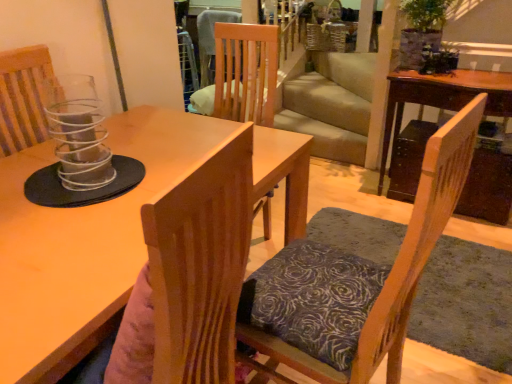
Identify the location of wooden table at right, which is the 2th table in front-to-back order. (442, 98).

The image size is (512, 384). I want to click on matte wooden table at center, the 2th table from the right, so click(x=83, y=244).

This screenshot has width=512, height=384. What do you see at coordinates (80, 144) in the screenshot?
I see `clear glass candle holder at left` at bounding box center [80, 144].

In order to click on clear glass candle holder at left in this screenshot , I will do `click(80, 144)`.

Where is `wooden chair with patterned cushion at center, the 2th chair from the left`? This screenshot has width=512, height=384. wooden chair with patterned cushion at center, the 2th chair from the left is located at coordinates [x=360, y=278].

Does matte wooden table at center, which is the second table from back to front, have a lesser height compared to wooden table at right, which is the first table from right to left?

Indeed, matte wooden table at center, which is the second table from back to front, has a lesser height compared to wooden table at right, which is the first table from right to left.

Between matte wooden table at center, the 2th table from the right, and wooden table at right, arranged as the second table when viewed from the left, which one has smaller size?

With smaller size is matte wooden table at center, the 2th table from the right.

Which point is more forward, (x=118, y=258) or (x=404, y=88)?

The point (x=118, y=258) is in front.

Between wooden chair with patterned cushion at center, the 1th chair when ordered from right to left, and wooden table at right, which is the first table from right to left, which one has smaller size?

With smaller size is wooden chair with patterned cushion at center, the 1th chair when ordered from right to left.

From a real-world perspective, is wooden chair with patterned cushion at center, the 1th chair when ordered from right to left, above or below wooden table at right, which appears as the first table when viewed from the back?

wooden chair with patterned cushion at center, the 1th chair when ordered from right to left, is situated higher than wooden table at right, which appears as the first table when viewed from the back, in the real world.

What's the angular difference between wooden chair with patterned cushion at center, the 1th chair when ordered from right to left, and wooden table at right, which is the first table from right to left,'s facing directions?

Result: 99.5 degrees separate the facing orientations of wooden chair with patterned cushion at center, the 1th chair when ordered from right to left, and wooden table at right, which is the first table from right to left.

Considering the sizes of objects wooden chair with patterned cushion at center, the 2th chair from the left, and wooden table at right, arranged as the second table when viewed from the left, in the image provided, who is taller, wooden chair with patterned cushion at center, the 2th chair from the left, or wooden table at right, arranged as the second table when viewed from the left,?

wooden chair with patterned cushion at center, the 2th chair from the left, is taller.

Who is bigger, clear glass candle holder at left or matte wooden table at center, which is the second table from back to front?

matte wooden table at center, which is the second table from back to front.

Does clear glass candle holder at left have a lesser width compared to matte wooden table at center, the 2th table from the right?

Yes, clear glass candle holder at left is thinner than matte wooden table at center, the 2th table from the right.

Between clear glass candle holder at left and matte wooden table at center, which ranks as the first table in front-to-back order, which one appears on the left side from the viewer's perspective?

clear glass candle holder at left is more to the left.

Who is shorter, clear glass candle holder at left or matte wooden table at center, which ranks as the first table in front-to-back order?

clear glass candle holder at left is shorter.

You are a GUI agent. You are given a task and a screenshot of the screen. Output one action in this format:
    pyautogui.click(x=<x>, y=<y>)
    Task: Click on the chair below the matte wooden table at center, the 1th table in the left-to-right sequence (from a real-world perspective)
    This screenshot has width=512, height=384.
    Given the screenshot: What is the action you would take?
    pyautogui.click(x=360, y=278)

Does wooden chair with patterned cushion at center, the 2th chair from the left, have a smaller size compared to matte wooden table at center, the 1th table in the left-to-right sequence?

No, wooden chair with patterned cushion at center, the 2th chair from the left, is not smaller than matte wooden table at center, the 1th table in the left-to-right sequence.

From the picture: From a real-world perspective, which object stands above the other?

matte wooden table at center, which ranks as the first table in front-to-back order, from a real-world perspective.

How different are the orientations of wooden chair with patterned cushion at center, the 2th chair from the left, and matte wooden table at center, which ranks as the first table in front-to-back order, in degrees?

7.91 degrees.

From a real-world perspective, which is physically below, transparent plastic chair at upper left, placed as the 2th chair when sorted from right to left, or matte wooden table at center, which ranks as the first table in front-to-back order?

matte wooden table at center, which ranks as the first table in front-to-back order.

Is transparent plastic chair at upper left, placed as the 2th chair when sorted from right to left, looking in the opposite direction of matte wooden table at center, which ranks as the first table in front-to-back order?

That's not correct — transparent plastic chair at upper left, placed as the 2th chair when sorted from right to left, is not looking away from matte wooden table at center, which ranks as the first table in front-to-back order.

Can you tell me how much transparent plastic chair at upper left, placed as the 2th chair when sorted from right to left, and matte wooden table at center, the 1th table in the left-to-right sequence, differ in facing direction?

There is a 178-degree angle between the facing directions of transparent plastic chair at upper left, placed as the 2th chair when sorted from right to left, and matte wooden table at center, the 1th table in the left-to-right sequence.

Does transparent plastic chair at upper left, placed as the 2th chair when sorted from right to left, come in front of matte wooden table at center, which is the second table from back to front?

No, it is behind matte wooden table at center, which is the second table from back to front.

Is transparent plastic chair at upper left, placed as the 2th chair when sorted from right to left, with clear glass candle holder at left?

No, transparent plastic chair at upper left, placed as the 2th chair when sorted from right to left, is not in contact with clear glass candle holder at left.

Which object is further away from the camera, transparent plastic chair at upper left, placed as the 2th chair when sorted from right to left, or clear glass candle holder at left?

transparent plastic chair at upper left, placed as the 2th chair when sorted from right to left, is more distant.

Based on the photo, is transparent plastic chair at upper left, the 1th chair viewed from the left, positioned with its back to clear glass candle holder at left?

No, transparent plastic chair at upper left, the 1th chair viewed from the left, is not facing away from clear glass candle holder at left.

Which object is thinner, matte wooden table at center, the 2th table from the right, or transparent plastic chair at upper left, placed as the 2th chair when sorted from right to left?

matte wooden table at center, the 2th table from the right.

From a real-world perspective, which is physically below, matte wooden table at center, which ranks as the first table in front-to-back order, or transparent plastic chair at upper left, the 1th chair viewed from the left?

matte wooden table at center, which ranks as the first table in front-to-back order, is physically lower.

Who is more distant, matte wooden table at center, the 2th table from the right, or transparent plastic chair at upper left, the 1th chair viewed from the left?

transparent plastic chair at upper left, the 1th chair viewed from the left, is further away from the camera.

Image resolution: width=512 pixels, height=384 pixels. I want to click on table above the wooden table at right, which is the 2th table in front-to-back order (from a real-world perspective), so coord(83,244).

This screenshot has width=512, height=384. Find the location of `table on the right of wooden chair with patterned cushion at center, the 1th chair when ordered from right to left`. table on the right of wooden chair with patterned cushion at center, the 1th chair when ordered from right to left is located at coordinates (442, 98).

Based on their spatial positions, is wooden table at right, which is the first table from right to left, or matte wooden table at center, which is the second table from back to front, further from transparent plastic chair at upper left, placed as the 2th chair when sorted from right to left?

wooden table at right, which is the first table from right to left, lies further to transparent plastic chair at upper left, placed as the 2th chair when sorted from right to left, than the other object.

Based on their spatial positions, is clear glass candle holder at left or transparent plastic chair at upper left, the 1th chair viewed from the left, closer to matte wooden table at center, which is the second table from back to front?

clear glass candle holder at left is positioned closer to the anchor matte wooden table at center, which is the second table from back to front.

Estimate the real-world distances between objects in this image. Which object is closer to clear glass candle holder at left, wooden chair with patterned cushion at center, the 2th chair from the left, or wooden table at right, which is the 2th table in front-to-back order?

wooden chair with patterned cushion at center, the 2th chair from the left, is closer to clear glass candle holder at left.

From the image, which object appears to be nearer to clear glass candle holder at left, transparent plastic chair at upper left, the 1th chair viewed from the left, or wooden chair with patterned cushion at center, the 2th chair from the left?

transparent plastic chair at upper left, the 1th chair viewed from the left, is closer to clear glass candle holder at left.

Looking at this image, estimate the real-world distances between objects in this image. Which object is further from transparent plastic chair at upper left, placed as the 2th chair when sorted from right to left, clear glass candle holder at left or wooden chair with patterned cushion at center, the 2th chair from the left?

wooden chair with patterned cushion at center, the 2th chair from the left, is further to transparent plastic chair at upper left, placed as the 2th chair when sorted from right to left.

When comparing their distances from transparent plastic chair at upper left, the 1th chair viewed from the left, does wooden chair with patterned cushion at center, the 2th chair from the left, or matte wooden table at center, the 1th table in the left-to-right sequence, seem further?

The object further to transparent plastic chair at upper left, the 1th chair viewed from the left, is wooden chair with patterned cushion at center, the 2th chair from the left.

From the image, which object appears to be farther from wooden chair with patterned cushion at center, the 2th chair from the left, matte wooden table at center, which ranks as the first table in front-to-back order, or clear glass candle holder at left?

Based on the image, clear glass candle holder at left appears to be further to wooden chair with patterned cushion at center, the 2th chair from the left.

Considering their positions, is wooden chair with patterned cushion at center, the 2th chair from the left, positioned further to transparent plastic chair at upper left, the 1th chair viewed from the left, than wooden table at right, arranged as the second table when viewed from the left?

wooden table at right, arranged as the second table when viewed from the left, lies further to transparent plastic chair at upper left, the 1th chair viewed from the left, than the other object.

At what (x,y) coordinates should I click in order to perform the action: click on chair located between transparent plastic chair at upper left, the 1th chair viewed from the left, and wooden table at right, which is the first table from right to left, in the left-right direction. Please return your answer as a coordinate pair (x, y). Looking at the image, I should click on (360, 278).

What are the coordinates of `candle holder situated between transparent plastic chair at upper left, placed as the 2th chair when sorted from right to left, and wooden table at right, which appears as the first table when viewed from the back, from left to right` in the screenshot? It's located at (80, 144).

You are a GUI agent. You are given a task and a screenshot of the screen. Output one action in this format:
    pyautogui.click(x=<x>, y=<y>)
    Task: Click on the table between clear glass candle holder at left and wooden table at right, which is the 2th table in front-to-back order
    The image size is (512, 384).
    Given the screenshot: What is the action you would take?
    pyautogui.click(x=83, y=244)

This screenshot has height=384, width=512. I want to click on table between transparent plastic chair at upper left, the 1th chair viewed from the left, and wooden table at right, which appears as the first table when viewed from the back, in the horizontal direction, so click(x=83, y=244).